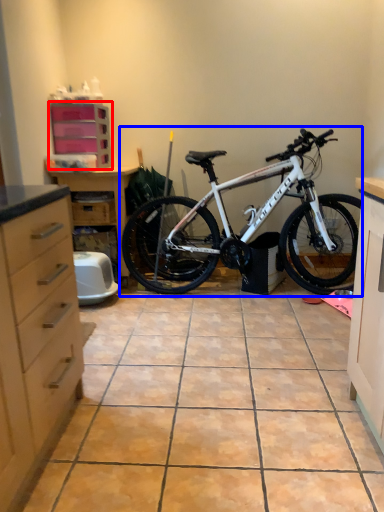
Question: Which object appears closest to the camera in this image, cabinetry (highlighted by a red box) or bicycle (highlighted by a blue box)?

Choices:
 (A) cabinetry
 (B) bicycle

Answer: (B)